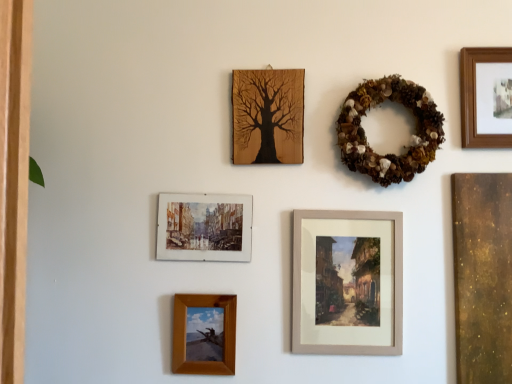
Question: Is watercolor paper painting at upper left, arranged as the fourth picture frame when viewed from the right, in front of or behind wooden framed painting at center, placed as the 2th picture frame when sorted from right to left, in the image?

Choices:
 (A) front
 (B) behind

Answer: (B)

Question: From the image's perspective, is watercolor paper painting at upper left, the 2th picture frame when ordered from left to right, above or below wooden framed painting at center, the fourth picture frame in the left-to-right sequence?

Choices:
 (A) below
 (B) above

Answer: (B)

Question: Estimate the real-world distances between objects in this image. Which object is closer to the wooden frame at upper right, which is the 5th picture frame in left-to-right order?

Choices:
 (A) watercolor paper painting at upper left, the 2th picture frame when ordered from left to right
 (B) brown textured wreath at upper right
 (C) wooden tree art at upper center, which is the third picture frame from left to right
 (D) wooden frame at lower center, which is the first picture frame in left-to-right order
 (E) wooden framed painting at center, placed as the 2th picture frame when sorted from right to left

Answer: (B)

Question: Which of these objects is positioned farthest from the wooden tree art at upper center, which is the third picture frame from right to left?

Choices:
 (A) wooden frame at lower center, which is the first picture frame in left-to-right order
 (B) watercolor paper painting at upper left, arranged as the fourth picture frame when viewed from the right
 (C) brown textured wreath at upper right
 (D) wooden framed painting at center, placed as the 2th picture frame when sorted from right to left
 (E) wooden frame at upper right, the 1th picture frame viewed from the right

Answer: (E)